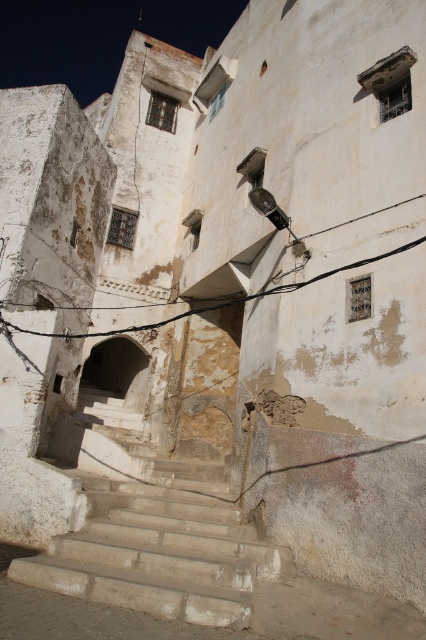
You are a painter who needs to decide which tool to use. You have a small brush and a large roller. The smooth concrete stairs at center and the black wire at upper center both need to be painted. Based on their sizes, which tool should you use for each object?

The smooth concrete stairs at center has a smaller size compared to black wire at upper center. Therefore, the small brush should be used for the smooth concrete stairs at center, and the large roller should be used for the black wire at upper center due to its larger size.

You are standing at the bottom of the smooth concrete stairs at center and want to climb up to the entrance. Is the black wire at upper center in your way?

The smooth concrete stairs at center is in front of the black wire at upper center, so the black wire at upper center is not blocking your path. You can climb the stairs without any obstruction.

You are a delivery person trying to place a package on the smooth concrete stairs at center. The black wire at upper center is nearby. Which object has a wider structure?

The black wire at upper center has a wider structure than the smooth concrete stairs at center.